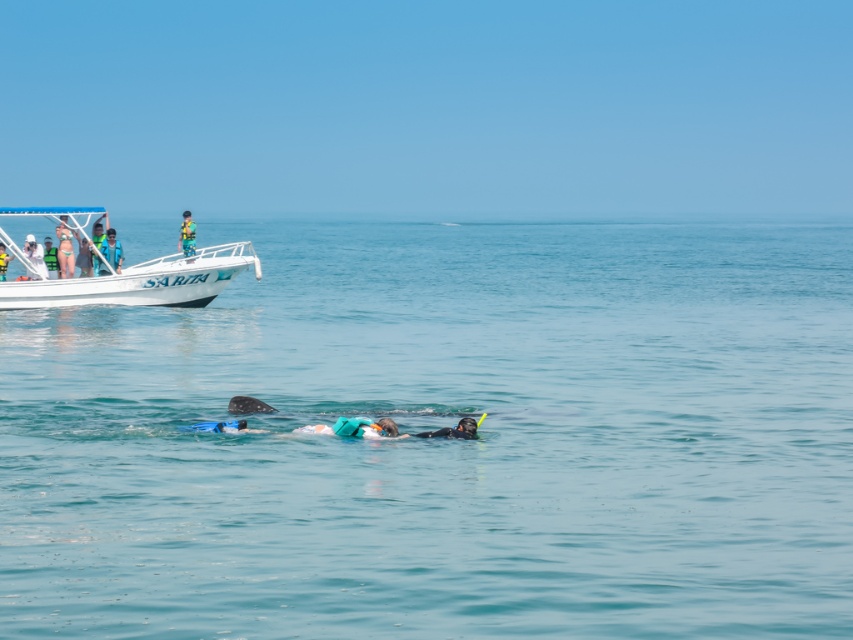
Question: Estimate the real-world distances between objects in this image. Which object is closer to the matte white camera at upper left?

Choices:
 (A) blue-green fabric shirt at left
 (B) matte bikini at left

Answer: (B)

Question: Is matte white camera at upper left positioned in front of green life vest at center?

Choices:
 (A) yes
 (B) no

Answer: (A)

Question: Does blue-green fabric shirt at left have a greater width compared to matte green bikini at upper left?

Choices:
 (A) yes
 (B) no

Answer: (A)

Question: Based on their relative distances, which object is nearer to the matte bikini at left?

Choices:
 (A) matte green bikini at upper left
 (B) black rubber snorkel at center

Answer: (A)

Question: Which point appears closest to the camera in this image?

Choices:
 (A) (65, 228)
 (B) (456, 429)

Answer: (B)

Question: Does matte bikini at left appear on the left side of matte green bikini at upper left?

Choices:
 (A) yes
 (B) no

Answer: (A)